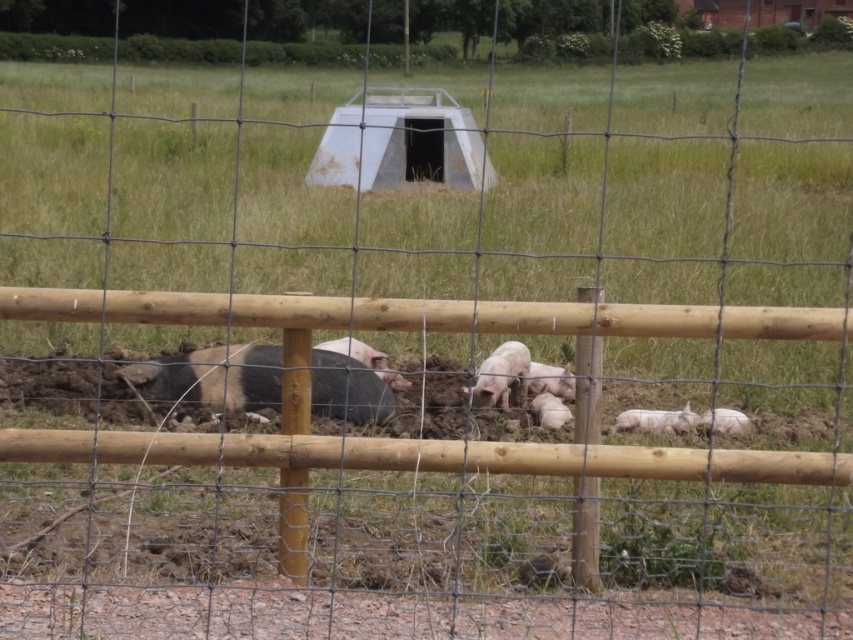
Consider the image. Does white fluffy piglet at lower right have a lesser width compared to white matte piglet at center?

Incorrect, white fluffy piglet at lower right's width is not less than white matte piglet at center's.

Who is higher up, white fluffy piglet at lower right or white matte piglet at center?

white matte piglet at center

Which is in front, point (738, 413) or point (532, 410)?

Positioned in front is point (738, 413).

At what (x,y) coordinates should I click in order to perform the action: click on white fluffy piglet at lower right. Please return your answer as a coordinate pair (x, y). The height and width of the screenshot is (640, 853). Looking at the image, I should click on (724, 420).

Is point (521, 385) farther from viewer compared to point (538, 420)?

Yes, it is.

Between point (490, 385) and point (544, 424), which one is positioned behind?

The point (490, 385) is behind.

In order to click on pink matte pig at center in this screenshot , I will do `click(502, 372)`.

Can you confirm if speckled fur pig at center is positioned to the right of pink matte pig at center?

Incorrect, speckled fur pig at center is not on the right side of pink matte pig at center.

Is point (329, 364) farther from viewer compared to point (505, 385)?

No, (329, 364) is closer to viewer.

Find the location of `speckled fur pig at center`. speckled fur pig at center is located at coordinates (212, 378).